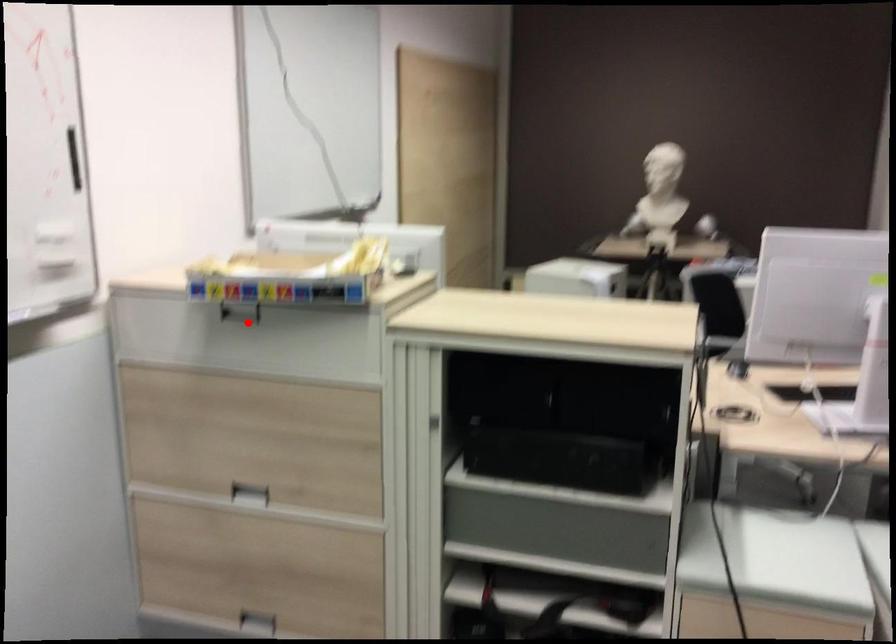
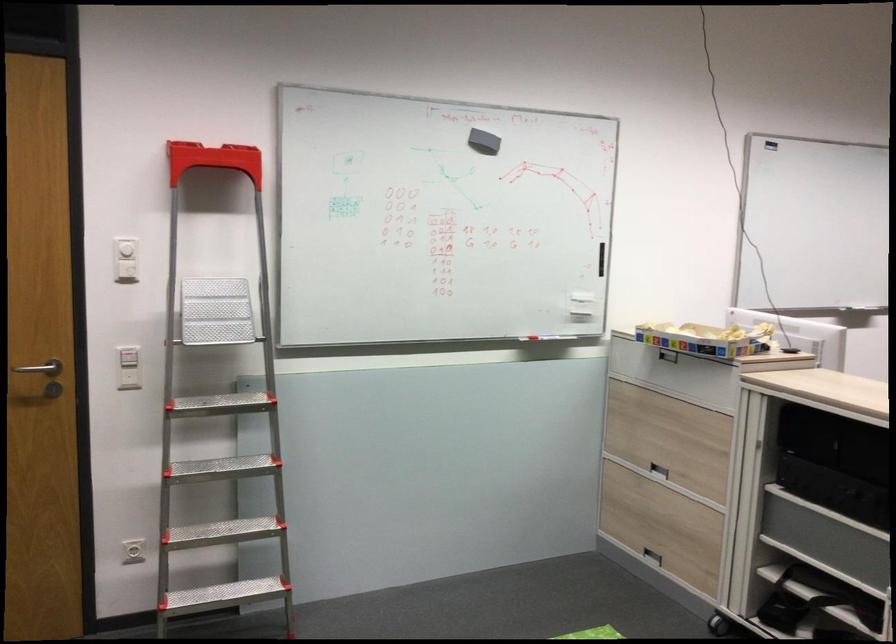
Question: I am providing you with two images of the same scene from different viewpoints. A red point is marked on the first image. Is the red point's position out of view in image 2?

Choices:
 (A) Yes
 (B) No

Answer: (B)